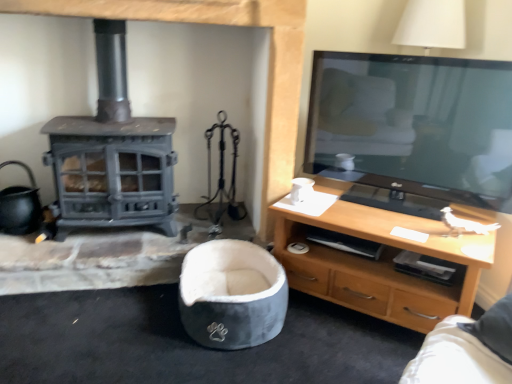
Question: Is point (246, 251) positioned closer to the camera than point (392, 251)?

Choices:
 (A) farther
 (B) closer

Answer: (A)

Question: Choose the correct answer: Is velvet grey bean bag chair at center inside light wood/finish tv stand at right or outside it?

Choices:
 (A) outside
 (B) inside

Answer: (A)

Question: Considering the positions of velvet grey bean bag chair at center and light wood/finish tv stand at right in the image, is velvet grey bean bag chair at center wider or thinner than light wood/finish tv stand at right?

Choices:
 (A) wide
 (B) thin

Answer: (B)

Question: Visually, is light wood/finish tv stand at right positioned to the left or to the right of velvet grey bean bag chair at center?

Choices:
 (A) left
 (B) right

Answer: (B)

Question: Considering the positions of point (375, 291) and point (209, 302), is point (375, 291) closer or farther from the camera than point (209, 302)?

Choices:
 (A) closer
 (B) farther

Answer: (B)

Question: Considering the positions of light wood/finish tv stand at right and velvet grey bean bag chair at center in the image, is light wood/finish tv stand at right taller or shorter than velvet grey bean bag chair at center?

Choices:
 (A) tall
 (B) short

Answer: (A)

Question: Is light wood/finish tv stand at right bigger or smaller than velvet grey bean bag chair at center?

Choices:
 (A) small
 (B) big

Answer: (B)